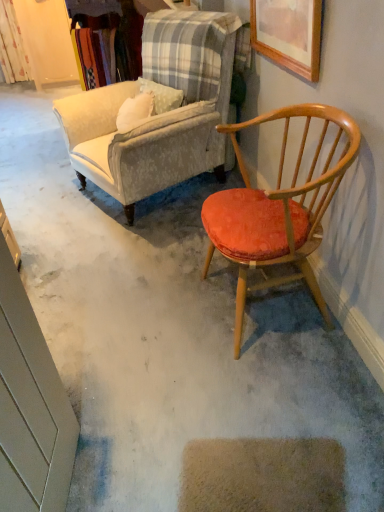
Identify the location of free location to the left of velvet beige armchair at upper left, the first chair when ordered from back to front. The width and height of the screenshot is (384, 512). (43, 184).